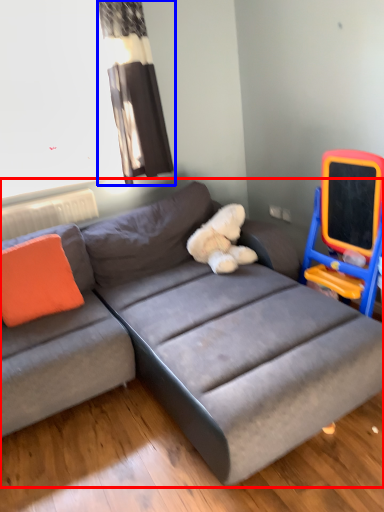
Question: Among these objects, which one is nearest to the camera, studio couch (highlighted by a red box) or curtain (highlighted by a blue box)?

Choices:
 (A) studio couch
 (B) curtain

Answer: (A)